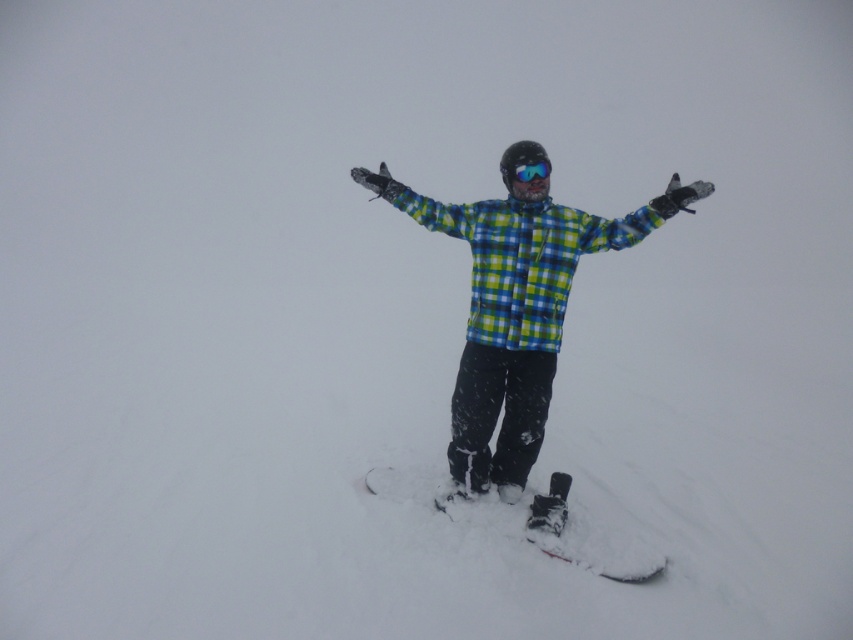
You are a photographer trying to capture the checkered fabric snowboarder at center and the blue reflective lens goggles at center in a single shot. Since the snowboarder is larger, will the goggles still be visible in the photo?

The checkered fabric snowboarder at center is bigger than blue reflective lens goggles at center, so the goggles will still be visible but smaller in the photo.

You are a photographer trying to capture the checkered fabric snowboarder at center and the black matte snowboard at center in a single shot. Since the background is white and there are no landmarks, how can you ensure both objects are clearly visible in your photo?

The black matte snowboard at center is behind the checkered fabric snowboarder at center, so positioning the camera so that the snowboarder is slightly forward will make both objects stand out against the white background while maintaining their visibility.

You are designing a winter sports poster and need to ensure the snowboarder and snowboard are proportionally sized. Given that the checkered fabric snowboarder at center and the black matte snowboard at center are both at the center, which one should be scaled down to maintain realistic proportions?

The checkered fabric snowboarder at center should be scaled down because its width is larger than the black matte snowboard at center, making it appear unrealistic if the snowboarder is wider than the snowboard.